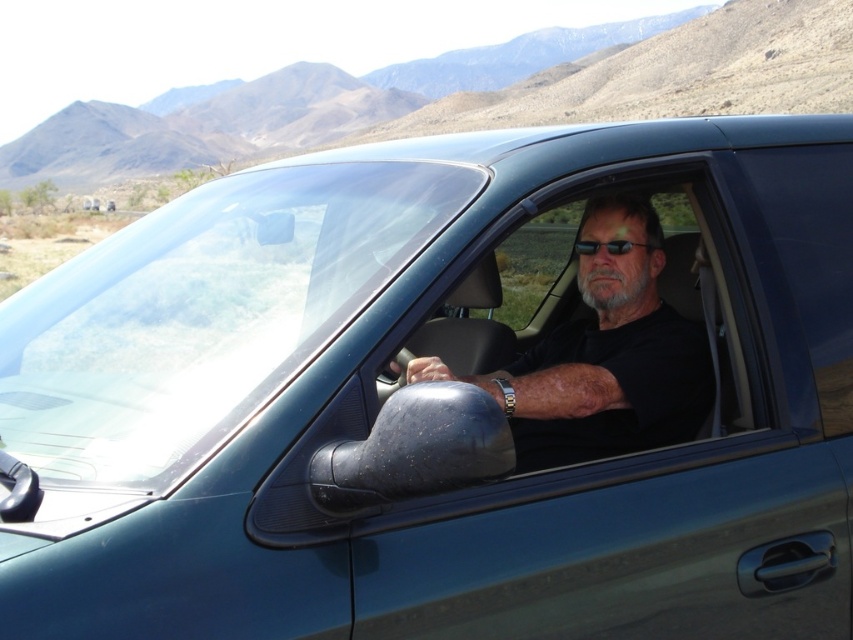
Question: Which point appears farthest from the camera in this image?

Choices:
 (A) (601, 243)
 (B) (596, 273)

Answer: (A)

Question: Is transparent glass window at center thinner than black plastic sunglasses at center?

Choices:
 (A) yes
 (B) no

Answer: (B)

Question: Can you confirm if transparent glass window at center is thinner than black plastic sunglasses at center?

Choices:
 (A) no
 (B) yes

Answer: (A)

Question: Which point is farther to the camera?

Choices:
 (A) (558, 472)
 (B) (640, 244)

Answer: (B)

Question: Among these points, which one is nearest to the camera?

Choices:
 (A) (589, 243)
 (B) (527, 397)

Answer: (B)

Question: Is black matte shirt at center further to camera compared to black plastic sunglasses at center?

Choices:
 (A) yes
 (B) no

Answer: (B)